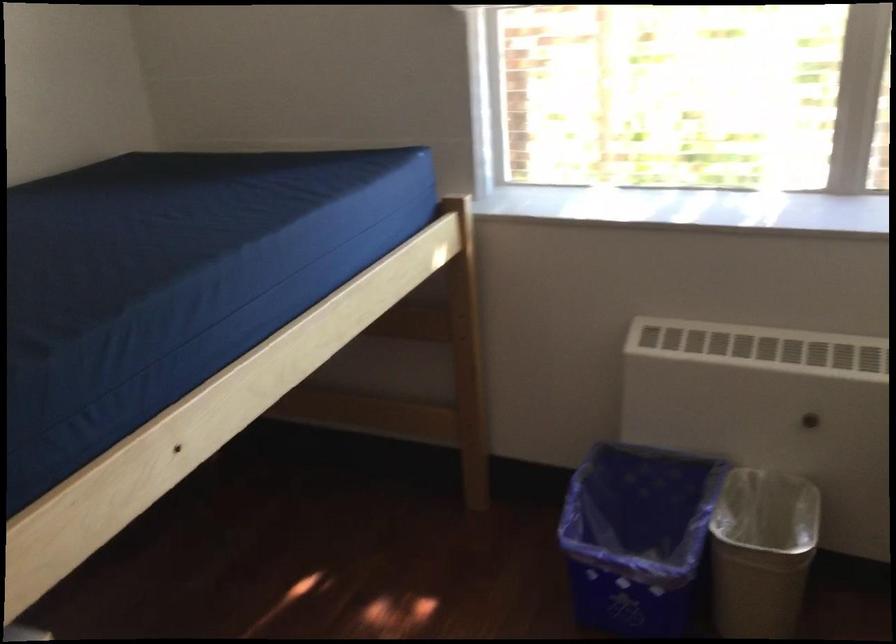
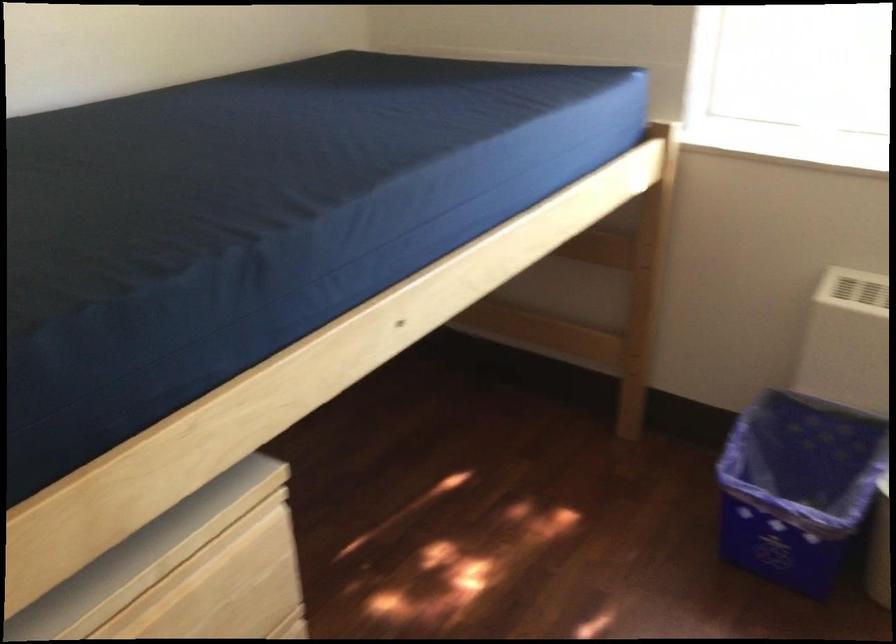
Question: The camera is either moving clockwise (left) or counter-clockwise (right) around the object. The first image is from the beginning of the video and the second image is from the end. Is the camera moving left or right when shooting the video?

Choices:
 (A) Left
 (B) Right

Answer: (B)